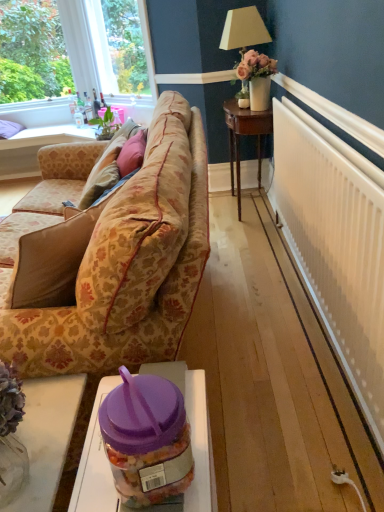
The width and height of the screenshot is (384, 512). What do you see at coordinates (47, 437) in the screenshot? I see `clear glass vase at lower left, which is counted as the second table, starting from the front` at bounding box center [47, 437].

Locate an element on the screen. This screenshot has height=512, width=384. clear glass window at upper left is located at coordinates (118, 46).

Describe the element at coordinates (335, 247) in the screenshot. The image size is (384, 512). I see `white matte radiator at right` at that location.

Image resolution: width=384 pixels, height=512 pixels. What do you see at coordinates (243, 29) in the screenshot?
I see `white fabric lampshade at upper right` at bounding box center [243, 29].

Identify the location of white fabric lampshade at upper right. The height and width of the screenshot is (512, 384). (243, 29).

Find the location of a particular element. This screenshot has width=384, height=512. floral-patterned fabric couch at center-left is located at coordinates (117, 264).

From the image's perspective, who appears lower, clear glass vase at lower left, which is counted as the second table, starting from the front, or wooden coffee table at lower left, the third table in the front-to-back sequence?

clear glass vase at lower left, which is counted as the second table, starting from the front, from the image's perspective.

Is point (39, 385) positioned after point (42, 131)?

No.

Can you tell me how much clear glass vase at lower left, which ranks as the 2th table in left-to-right order, and wooden coffee table at lower left, the third table in the front-to-back sequence, differ in facing direction?

The angular difference between clear glass vase at lower left, which ranks as the 2th table in left-to-right order, and wooden coffee table at lower left, the third table in the front-to-back sequence, is 93.7 degrees.

Consider the image. From a real-world perspective, which is physically above, clear glass vase at lower left, which appears as the 2th table when viewed from the back, or wooden coffee table at lower left, the third table positioned from the right?

In real-world perspective, clear glass vase at lower left, which appears as the 2th table when viewed from the back, is above.

Does green leafy plant at upper left have a lesser height compared to wooden coffee table at lower left, the 1th table viewed from the back?

No, green leafy plant at upper left is not shorter than wooden coffee table at lower left, the 1th table viewed from the back.

Considering the relative positions of green leafy plant at upper left and wooden coffee table at lower left, marked as the 1th table in a left-to-right arrangement, in the image provided, is green leafy plant at upper left behind wooden coffee table at lower left, marked as the 1th table in a left-to-right arrangement,?

Yes, green leafy plant at upper left is further from the viewer.

From the image's perspective, is green leafy plant at upper left on top of wooden coffee table at lower left, the third table from the bottom?

Indeed, from the image's perspective, green leafy plant at upper left is shown above wooden coffee table at lower left, the third table from the bottom.

Is green leafy plant at upper left facing away from wooden coffee table at lower left, the third table in the front-to-back sequence?

green leafy plant at upper left is not turned away from wooden coffee table at lower left, the third table in the front-to-back sequence.

From the image's perspective, which object appears higher, clear glass vase at lower left, the 1th table ordered from the bottom, or white matte radiator at right?

white matte radiator at right appears higher in the image.

Starting from the white matte radiator at right, which table is the 1st one in front? Please provide its 2D coordinates.

[(47, 437)]

Looking at the image, does clear glass vase at lower left, which is counted as the second table, starting from the front, seem bigger or smaller compared to white matte radiator at right?

Clearly, clear glass vase at lower left, which is counted as the second table, starting from the front, is smaller in size than white matte radiator at right.

From the image's perspective, which one is positioned higher, white fabric lampshade at upper right or purple plastic jar at lower center, the third table in the left-to-right sequence?

white fabric lampshade at upper right.

Looking at this image, is white fabric lampshade at upper right in contact with purple plastic jar at lower center, marked as the first table in a front-to-back arrangement?

No, white fabric lampshade at upper right is not touching purple plastic jar at lower center, marked as the first table in a front-to-back arrangement.

Looking at their sizes, would you say white fabric lampshade at upper right is wider or thinner than purple plastic jar at lower center, arranged as the 2th table when viewed from the top?

Clearly, white fabric lampshade at upper right has more width compared to purple plastic jar at lower center, arranged as the 2th table when viewed from the top.

You are a GUI agent. You are given a task and a screenshot of the screen. Output one action in this format:
    pyautogui.click(x=<x>, y=<y>)
    Task: Click on the lamp that appears on the right of purple plastic jar at lower center, which is counted as the 3th table, starting from the back
    
    Given the screenshot: What is the action you would take?
    pyautogui.click(x=243, y=29)

Is green leafy plant at upper left positioned in front of white matte radiator at right?

No, it is behind white matte radiator at right.

Based on the photo, from the image's perspective, between green leafy plant at upper left and white matte radiator at right, which one is located above?

green leafy plant at upper left is shown above in the image.

Considering the sizes of objects green leafy plant at upper left and white matte radiator at right in the image provided, who is taller, green leafy plant at upper left or white matte radiator at right?

Standing taller between the two is green leafy plant at upper left.

Considering the relative sizes of green leafy plant at upper left and white matte radiator at right in the image provided, is green leafy plant at upper left wider than white matte radiator at right?

Indeed, green leafy plant at upper left has a greater width compared to white matte radiator at right.

How distant is clear glass vase at lower left, the 3th table viewed from the top, from green leafy plant at upper left?

A distance of 17.21 feet exists between clear glass vase at lower left, the 3th table viewed from the top, and green leafy plant at upper left.

From the image's perspective, is clear glass vase at lower left, which appears as the 2th table when viewed from the back, above or below green leafy plant at upper left?

clear glass vase at lower left, which appears as the 2th table when viewed from the back, is below green leafy plant at upper left.

Would you say clear glass vase at lower left, which is counted as the second table, starting from the front, contains green leafy plant at upper left?

No.

From a real-world perspective, which table is the 2nd one underneath the green leafy plant at upper left? Please provide its 2D coordinates.

[(47, 437)]

Is white matte radiator at right positioned in front of clear glass window at upper left?

Yes, white matte radiator at right is in front of clear glass window at upper left.

Based on the photo, is white matte radiator at right inside the boundaries of clear glass window at upper left, or outside?

white matte radiator at right is not enclosed by clear glass window at upper left.

Are white matte radiator at right and clear glass window at upper left far apart?

Absolutely, white matte radiator at right is distant from clear glass window at upper left.

From the image's perspective, is white matte radiator at right on top of clear glass window at upper left?

No, from the image's perspective, white matte radiator at right is not over clear glass window at upper left.

This screenshot has width=384, height=512. In order to click on table on the left of clear glass vase at lower left, which appears as the 2th table when viewed from the back in this screenshot , I will do `click(35, 148)`.

The width and height of the screenshot is (384, 512). I want to click on plant lying above the wooden coffee table at lower left, the third table positioned from the right (from the image's perspective), so click(32, 51).

When comparing their distances from velvet pink pillow at center, does floral-patterned fabric couch at center-left or clear glass window at upper left seem closer?

Among the two, floral-patterned fabric couch at center-left is located nearer to velvet pink pillow at center.

Considering their positions, is clear glass window at upper left positioned further to purple plastic jar at lower center, arranged as the 2th table when viewed from the top, than clear glass vase at lower left, which is counted as the second table, starting from the front?

Based on the image, clear glass window at upper left appears to be further to purple plastic jar at lower center, arranged as the 2th table when viewed from the top.

Which object lies nearer to the anchor point white fabric lampshade at upper right, clear glass window at upper left or velvet pink pillow at center?

velvet pink pillow at center.

Looking at the image, which one is located closer to white matte radiator at right, clear glass vase at lower left, which ranks as the 2th table in left-to-right order, or purple plastic jar at lower center, the third table in the left-to-right sequence?

purple plastic jar at lower center, the third table in the left-to-right sequence.

Considering their positions, is clear glass vase at lower left, the 3th table viewed from the top, positioned closer to clear glass window at upper left than white matte radiator at right?

white matte radiator at right lies closer to clear glass window at upper left than the other object.

Considering their positions, is floral-patterned fabric couch at center-left positioned closer to wooden coffee table at lower left, the 1th table viewed from the back, than white fabric lampshade at upper right?

white fabric lampshade at upper right.

When comparing their distances from floral-patterned fabric couch at center-left, does clear glass window at upper left or wooden coffee table at lower left, the 1th table viewed from the back, seem further?

clear glass window at upper left is further to floral-patterned fabric couch at center-left.

When comparing their distances from floral-patterned fabric couch at center-left, does white matte radiator at right or green leafy plant at upper left seem closer?

white matte radiator at right is positioned closer to the anchor floral-patterned fabric couch at center-left.

The height and width of the screenshot is (512, 384). Identify the location of lamp located between clear glass vase at lower left, which is counted as the second table, starting from the front, and wooden coffee table at lower left, the third table in the front-to-back sequence, in the depth direction. click(x=243, y=29).

Where is `studio couch positioned between purple plastic jar at lower center, the second table in the bottom-to-top sequence, and green leafy plant at upper left from near to far`? studio couch positioned between purple plastic jar at lower center, the second table in the bottom-to-top sequence, and green leafy plant at upper left from near to far is located at coordinates (117, 264).

This screenshot has width=384, height=512. I want to click on radiator positioned between purple plastic jar at lower center, which is counted as the 3th table, starting from the back, and green leafy plant at upper left from near to far, so click(x=335, y=247).

I want to click on lamp between white matte radiator at right and clear glass window at upper left along the z-axis, so click(x=243, y=29).